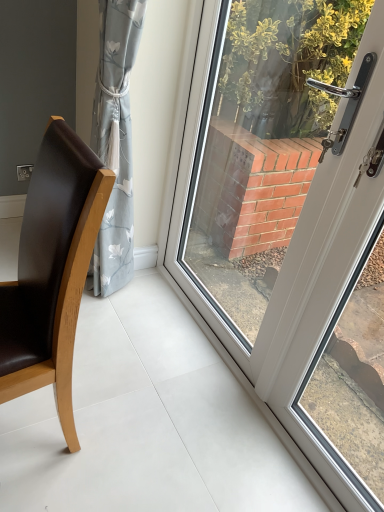
You are a GUI agent. You are given a task and a screenshot of the screen. Output one action in this format:
    pyautogui.click(x=<x>, y=<y>)
    Task: Click on the vacant area situated below brown leather chair at left (from a real-world perspective)
    This screenshot has width=384, height=512.
    Given the screenshot: What is the action you would take?
    pyautogui.click(x=43, y=417)